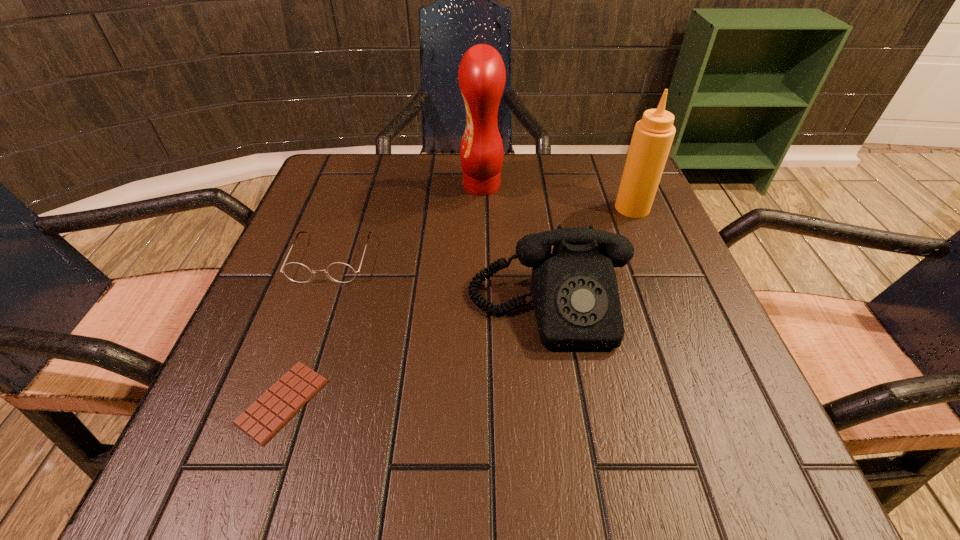
In order to click on vacant space located 0.200m on the dial of the telephone in this screenshot , I will do `click(576, 489)`.

Find the location of a particular element. The width and height of the screenshot is (960, 540). vacant space situated on the front-facing side of the spectacles is located at coordinates (274, 423).

This screenshot has width=960, height=540. Find the location of `free space located on the back of the nearest object`. free space located on the back of the nearest object is located at coordinates (331, 263).

Where is `object at the near edge`? The width and height of the screenshot is (960, 540). object at the near edge is located at coordinates (265, 417).

Where is `spectacles at the left edge`? This screenshot has width=960, height=540. spectacles at the left edge is located at coordinates (342, 273).

This screenshot has width=960, height=540. I want to click on candy bar present at the left edge, so click(x=265, y=417).

Find the location of a particular element. This screenshot has width=960, height=540. condiment that is at the right edge is located at coordinates (653, 135).

I want to click on telephone that is positioned at the right edge, so click(574, 290).

Where is `object present at the near left corner`? The width and height of the screenshot is (960, 540). object present at the near left corner is located at coordinates (265, 417).

Identify the location of object at the far right corner. The height and width of the screenshot is (540, 960). (653, 135).